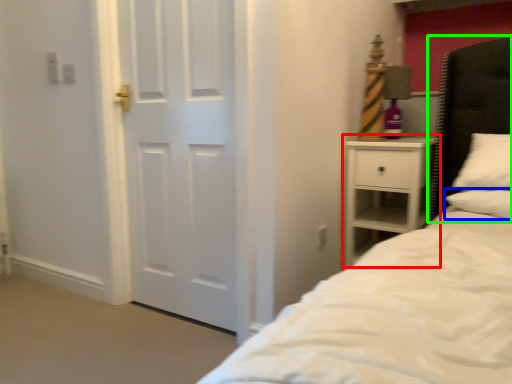
Question: Which object is the farthest from nightstand (highlighted by a red box)? Choose among these: pillow (highlighted by a blue box) or headboard (highlighted by a green box).

Choices:
 (A) pillow
 (B) headboard

Answer: (A)